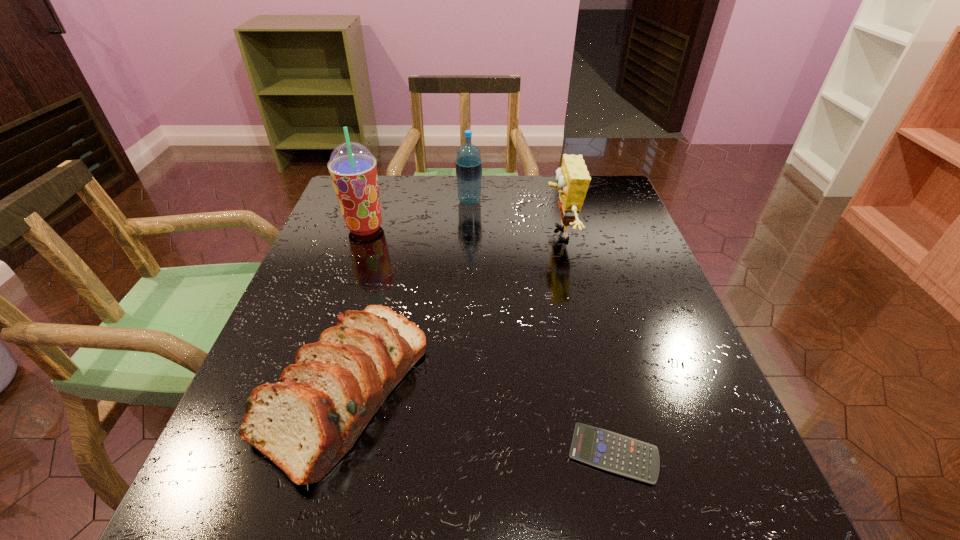
Where is `vacant area located on the right of the fourth tallest object`? The height and width of the screenshot is (540, 960). vacant area located on the right of the fourth tallest object is located at coordinates (597, 389).

You are a GUI agent. You are given a task and a screenshot of the screen. Output one action in this format:
    pyautogui.click(x=<x>, y=<y>)
    Task: Click on the vacant region located on the back of the shortest object
    The width and height of the screenshot is (960, 540).
    Given the screenshot: What is the action you would take?
    pyautogui.click(x=596, y=383)

What are the coordinates of `smoothie positioned at the far edge` in the screenshot? It's located at (353, 169).

Where is `water bottle positioned at the far edge`? This screenshot has width=960, height=540. water bottle positioned at the far edge is located at coordinates (468, 163).

You are a GUI agent. You are given a task and a screenshot of the screen. Output one action in this format:
    pyautogui.click(x=<x>, y=<y>)
    Task: Click on the sponge that is at the far edge
    This screenshot has width=960, height=540.
    Given the screenshot: What is the action you would take?
    pyautogui.click(x=573, y=179)

This screenshot has width=960, height=540. In order to click on bread located at the near edge in this screenshot , I will do pyautogui.click(x=305, y=423).

I want to click on calculator that is at the near edge, so click(x=606, y=450).

Find the location of `smoothie located in the left edge section of the desktop`. smoothie located in the left edge section of the desktop is located at coordinates (353, 169).

The image size is (960, 540). Find the location of `bread at the left edge`. bread at the left edge is located at coordinates (305, 423).

Image resolution: width=960 pixels, height=540 pixels. Find the location of `sponge situated at the right edge`. sponge situated at the right edge is located at coordinates (x=573, y=179).